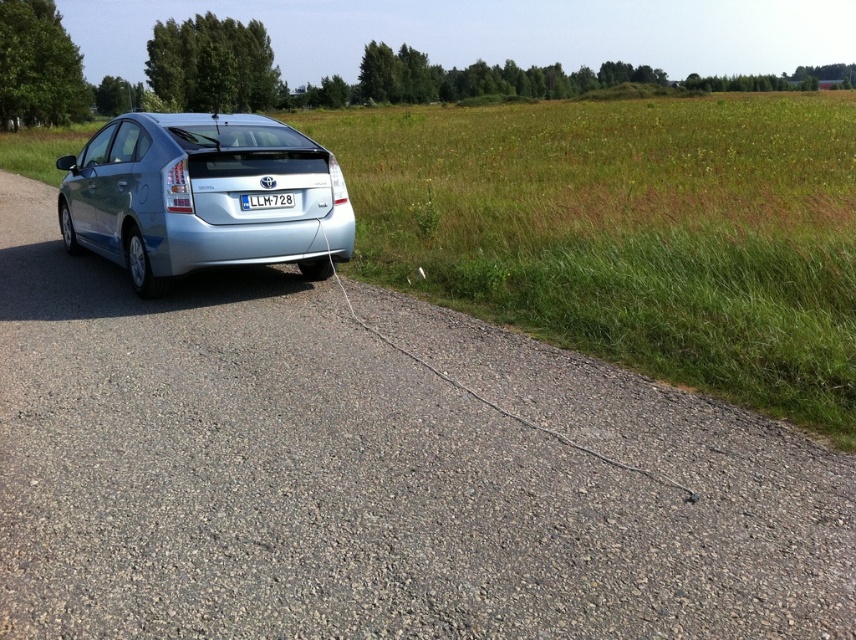
Question: Among these objects, which one is farthest from the camera?

Choices:
 (A) white plastic license plate at center
 (B) satin silver sedan at center

Answer: (A)

Question: Can you confirm if satin silver sedan at center is smaller than white plastic license plate at center?

Choices:
 (A) no
 (B) yes

Answer: (A)

Question: Which point is closer to the camera?

Choices:
 (A) satin silver sedan at center
 (B) white plastic license plate at center

Answer: (A)

Question: Does satin silver sedan at center appear on the left side of white plastic license plate at center?

Choices:
 (A) no
 (B) yes

Answer: (B)

Question: Is satin silver sedan at center above white plastic license plate at center?

Choices:
 (A) yes
 (B) no

Answer: (A)

Question: Which point is closer to the camera?

Choices:
 (A) (272, 198)
 (B) (201, 113)

Answer: (A)